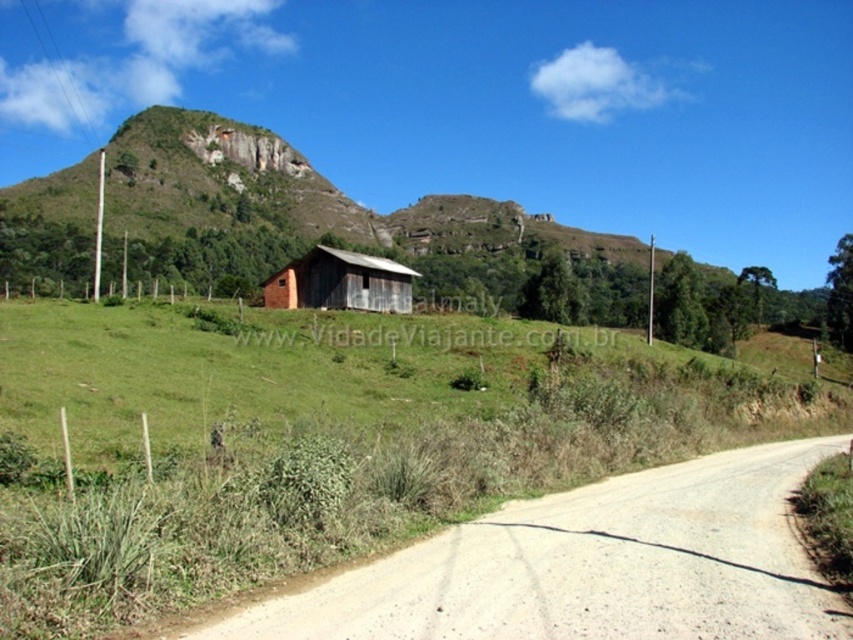
Question: Observing the image, what is the correct spatial positioning of brown gravel road at lower left in reference to rustic wooden barn at center?

Choices:
 (A) right
 (B) left

Answer: (A)

Question: Does brown gravel road at lower left have a greater width compared to rustic wooden barn at center?

Choices:
 (A) yes
 (B) no

Answer: (A)

Question: Which of the following is the farthest from the observer?

Choices:
 (A) (381, 637)
 (B) (383, 289)

Answer: (B)

Question: Is brown gravel road at lower left wider than rustic wooden barn at center?

Choices:
 (A) no
 (B) yes

Answer: (B)

Question: Which of the following is the farthest from the observer?

Choices:
 (A) (323, 248)
 (B) (592, 572)

Answer: (A)